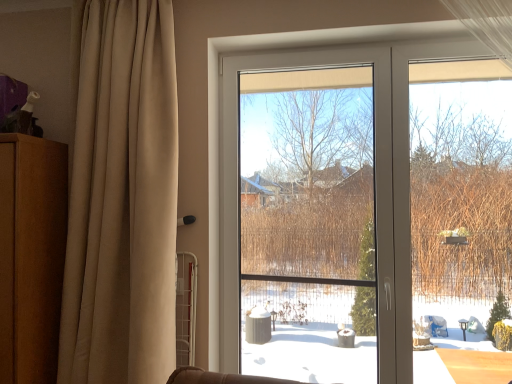
This screenshot has height=384, width=512. Find the location of `transparent plastic window screen at center`. transparent plastic window screen at center is located at coordinates (307, 225).

I want to click on beige fabric curtain at left, so click(x=122, y=199).

Between transparent plastic window screen at center and beige fabric curtain at left, which one has more height?

beige fabric curtain at left.

Between point (286, 172) and point (75, 174), which one is positioned behind?

The point (286, 172) is farther.

Which is correct: transparent plastic window screen at center is inside beige fabric curtain at left, or outside of it?

transparent plastic window screen at center is not inside beige fabric curtain at left, it's outside.

From a real-world perspective, relative to beige fabric curtain at left, is transparent plastic window screen at center vertically above or below?

Clearly, from a real-world perspective, transparent plastic window screen at center is below beige fabric curtain at left.

Is brown wood dresser at left closer to the viewer compared to beige fabric curtain at left?

That is False.

From a real-world perspective, is brown wood dresser at left below beige fabric curtain at left?

Yes, from a real-world perspective, brown wood dresser at left is under beige fabric curtain at left.

In the scene shown: Is brown wood dresser at left directly adjacent to beige fabric curtain at left?

brown wood dresser at left and beige fabric curtain at left are clearly separated.

In the scene shown: Considering the relative sizes of brown wood dresser at left and beige fabric curtain at left in the image provided, is brown wood dresser at left wider than beige fabric curtain at left?

Correct, the width of brown wood dresser at left exceeds that of beige fabric curtain at left.

How far apart are transparent plastic window screen at center and brown wood dresser at left?

transparent plastic window screen at center is 3.84 feet away from brown wood dresser at left.

Can you confirm if transparent plastic window screen at center is taller than brown wood dresser at left?

Yes.

Is transparent plastic window screen at center not close to brown wood dresser at left?

Absolutely, transparent plastic window screen at center is distant from brown wood dresser at left.

From a real-world perspective, is transparent plastic window screen at center under brown wood dresser at left?

No, from a real-world perspective, transparent plastic window screen at center is not below brown wood dresser at left.

From the image's perspective, is brown wood dresser at left located above or below transparent plastic window screen at center?

From the image's perspective, brown wood dresser at left appears below transparent plastic window screen at center.

Looking at this image, is brown wood dresser at left placed right next to transparent plastic window screen at center?

No, brown wood dresser at left is not in contact with transparent plastic window screen at center.

In the scene shown: Is brown wood dresser at left oriented away from transparent plastic window screen at center?

brown wood dresser at left does not have its back to transparent plastic window screen at center.

Find the location of a particular element. curtain in front of the brown wood dresser at left is located at coordinates (122, 199).

Between point (165, 20) and point (45, 349), which one is positioned behind?

The point (45, 349) is farther from the camera.

Are beige fabric curtain at left and brown wood dresser at left far apart?

They are positioned close to each other.

From the picture: From a real-world perspective, is beige fabric curtain at left physically located above or below brown wood dresser at left?

beige fabric curtain at left is above brown wood dresser at left.

Which object is further away from the camera, beige fabric curtain at left or transparent plastic window screen at center?

Positioned behind is transparent plastic window screen at center.

Consider the image. Is beige fabric curtain at left placed right next to transparent plastic window screen at center?

No, beige fabric curtain at left is not making contact with transparent plastic window screen at center.

From the image's perspective, which object appears higher, beige fabric curtain at left or transparent plastic window screen at center?

From the image's view, beige fabric curtain at left is above.

Does beige fabric curtain at left have a lesser width compared to transparent plastic window screen at center?

No.

The height and width of the screenshot is (384, 512). I want to click on curtain lying on the left of transparent plastic window screen at center, so click(122, 199).

At what (x,y) coordinates should I click in order to perform the action: click on curtain above the brown wood dresser at left (from the image's perspective). Please return your answer as a coordinate pair (x, y). This screenshot has height=384, width=512. Looking at the image, I should click on (122, 199).

Estimate the real-world distances between objects in this image. Which object is closer to beige fabric curtain at left, transparent plastic window screen at center or brown wood dresser at left?

brown wood dresser at left lies closer to beige fabric curtain at left than the other object.

From the image, which object appears to be farther from beige fabric curtain at left, brown wood dresser at left or transparent plastic window screen at center?

Based on the image, transparent plastic window screen at center appears to be further to beige fabric curtain at left.

Looking at the image, which one is located further to brown wood dresser at left, transparent plastic window screen at center or beige fabric curtain at left?

transparent plastic window screen at center lies further to brown wood dresser at left than the other object.

From the image, which object appears to be farther from transparent plastic window screen at center, brown wood dresser at left or beige fabric curtain at left?

Based on the image, brown wood dresser at left appears to be further to transparent plastic window screen at center.

From the image, which object appears to be nearer to brown wood dresser at left, beige fabric curtain at left or transparent plastic window screen at center?

Based on the image, beige fabric curtain at left appears to be nearer to brown wood dresser at left.

Which object lies further to the anchor point transparent plastic window screen at center, beige fabric curtain at left or brown wood dresser at left?

Based on the image, brown wood dresser at left appears to be further to transparent plastic window screen at center.

Find the location of a particular element. The width and height of the screenshot is (512, 384). curtain between brown wood dresser at left and transparent plastic window screen at center in the horizontal direction is located at coordinates (122, 199).